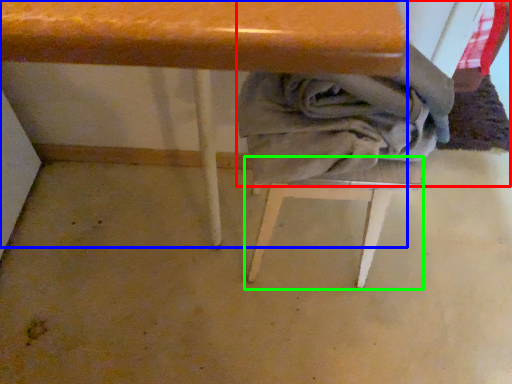
Question: Which object is positioned farthest from laundry (highlighted by a red box)? Select from table (highlighted by a blue box) and step stool (highlighted by a green box).

Choices:
 (A) table
 (B) step stool

Answer: (A)